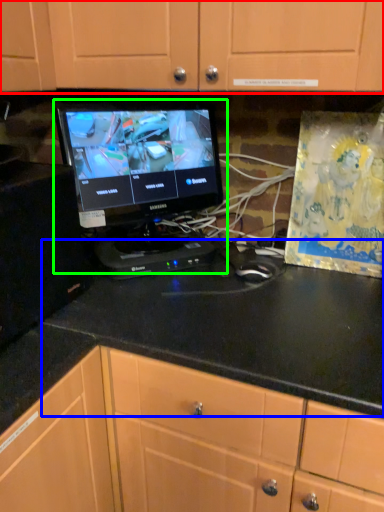
Question: Based on their relative distances, which object is nearer to cabinetry (highlighted by a red box)? Choose from counter top (highlighted by a blue box) and computer monitor (highlighted by a green box).

Choices:
 (A) counter top
 (B) computer monitor

Answer: (B)